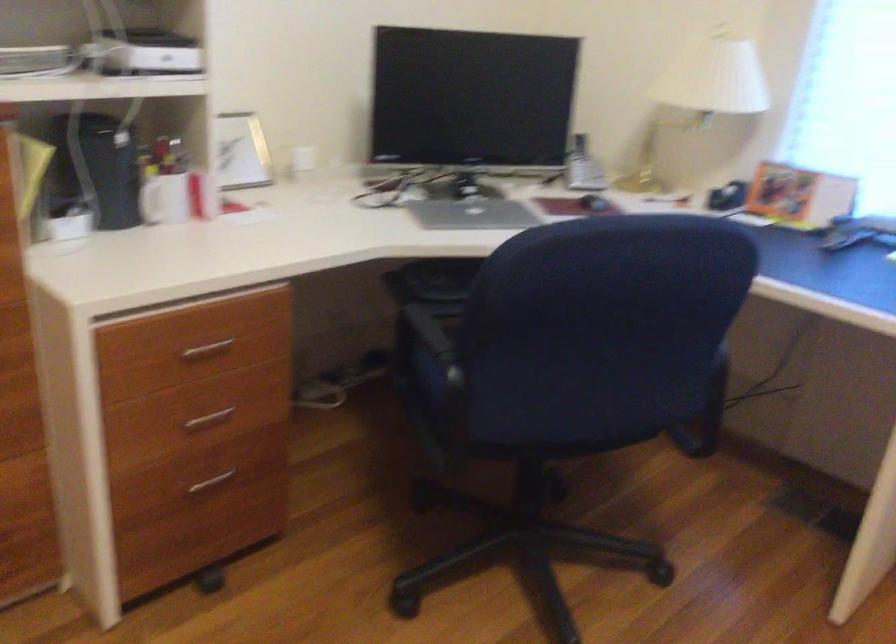
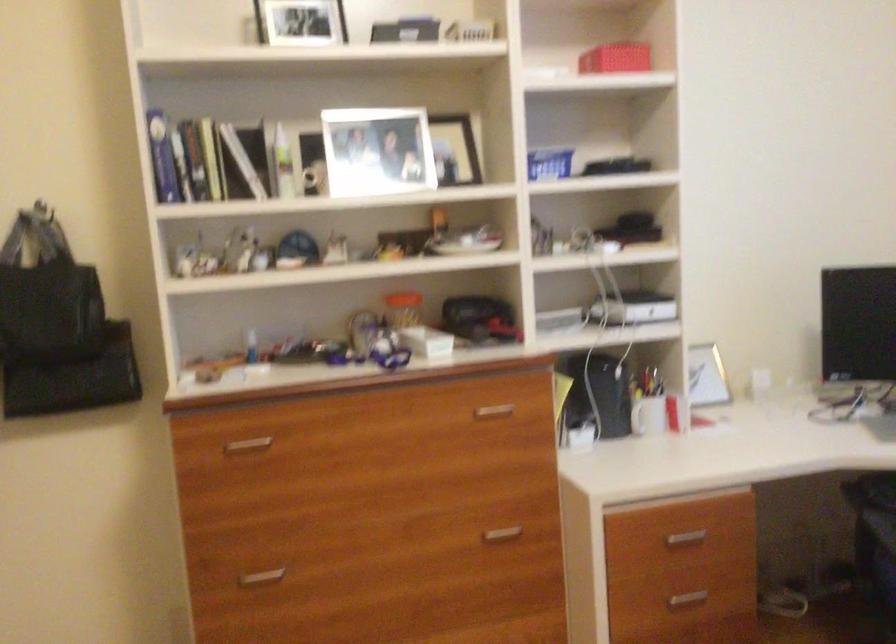
Find the pixel in the second image that matches point (197, 354) in the first image.

(685, 538)